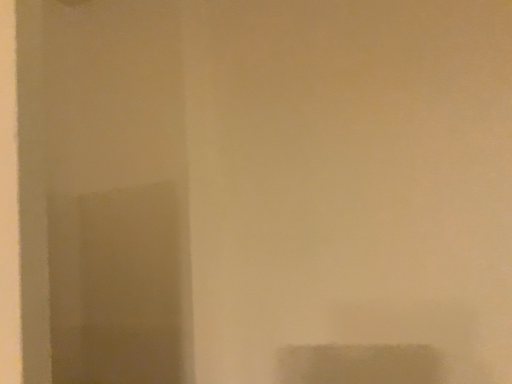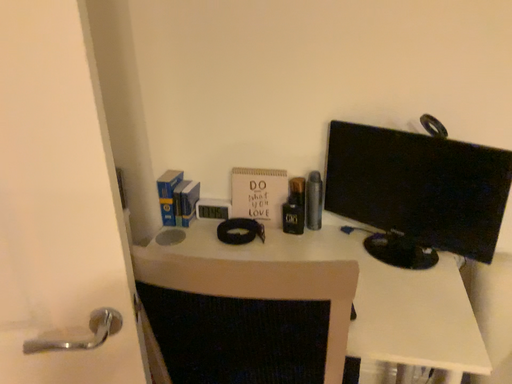
Question: Which way did the camera rotate in the video?

Choices:
 (A) rotated upward
 (B) rotated downward

Answer: (B)